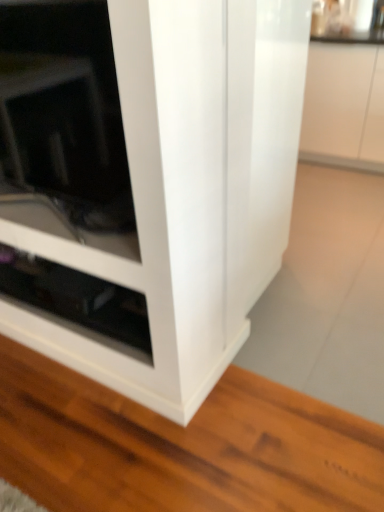
Question: Should I look upward or downward to see black glossy drawer at lower left?

Choices:
 (A) down
 (B) up

Answer: (A)